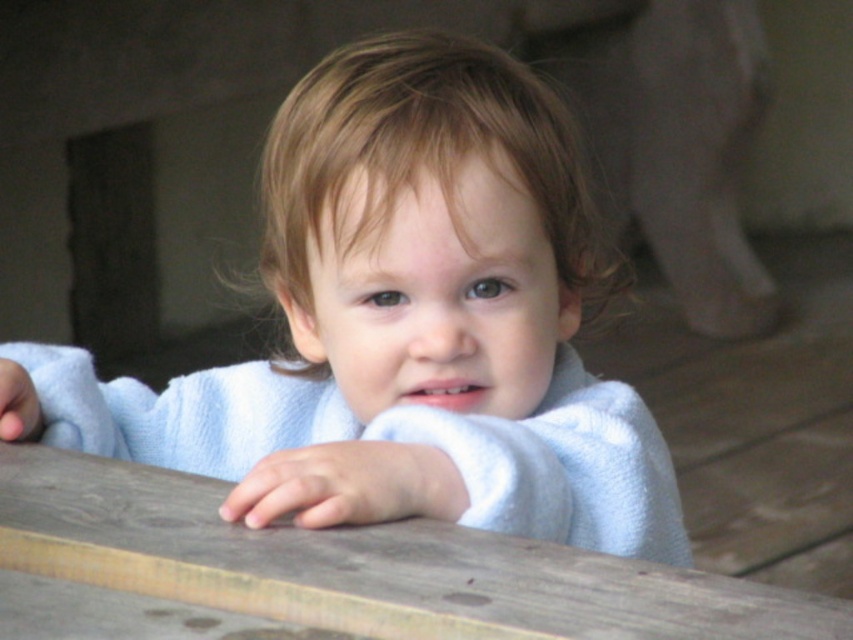
You are a photographer setting up for a portrait session. The scene has a wooden table at center and a white fluffy robe at center. Which object takes up more space in the frame?

The white fluffy robe at center occupies more space in the frame than the wooden table at center.

You are a photographer setting up a shoot in this scene. You need to place a small vase between the white soft towel at center and the wooden table at center. According to the scene description, where should you position the vase?

The white soft towel at center is to the right of the wooden table at center. Therefore, the vase should be placed between them, to the right of the wooden table at center and to the left of the white soft towel at center.